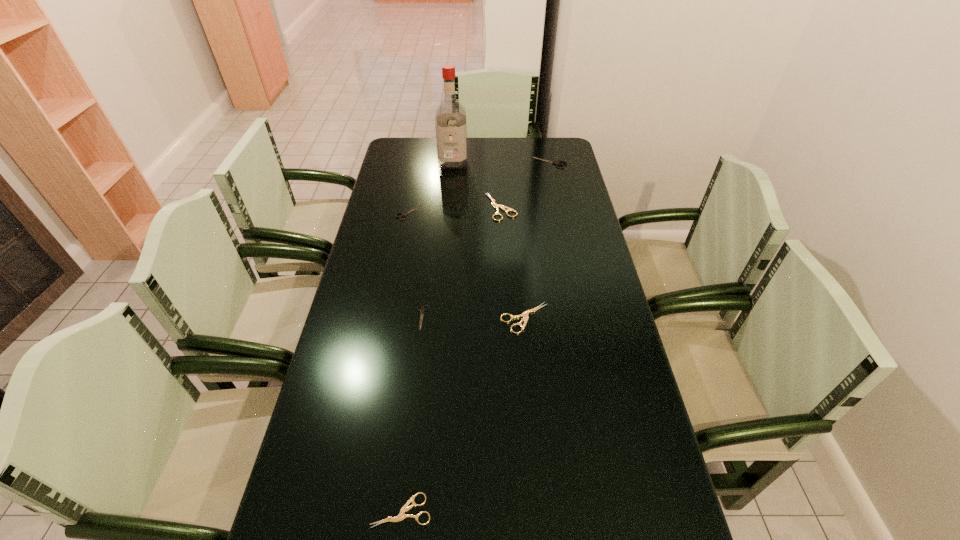
Find the location of a particular element. object present at the left edge is located at coordinates (406, 213).

The image size is (960, 540). I want to click on object located in the right edge section of the desktop, so click(557, 163).

Where is `object located at the far right corner`? This screenshot has width=960, height=540. object located at the far right corner is located at coordinates (557, 163).

The width and height of the screenshot is (960, 540). I want to click on blank area at the far edge, so click(499, 143).

At what (x,y) coordinates should I click in order to perform the action: click on free space at the left edge of the desktop. Please return your answer as a coordinate pair (x, y). The width and height of the screenshot is (960, 540). Looking at the image, I should click on (385, 327).

Where is `vacant space at the right edge of the desktop`? Image resolution: width=960 pixels, height=540 pixels. vacant space at the right edge of the desktop is located at coordinates (625, 440).

In the image, there is a desktop. At what (x,y) coordinates should I click in order to perform the action: click on free region at the far left corner. Please return your answer as a coordinate pair (x, y). This screenshot has width=960, height=540. Looking at the image, I should click on (412, 144).

In order to click on vacant area that lies between the farthest beige shears and the smallest black shears in this screenshot , I will do `click(462, 262)`.

Locate an element on the screen. empty space that is in between the leftmost black shears and the smallest black shears is located at coordinates (416, 265).

Identify the location of free space that is in between the nearest black shears and the tallest object. The height and width of the screenshot is (540, 960). (438, 240).